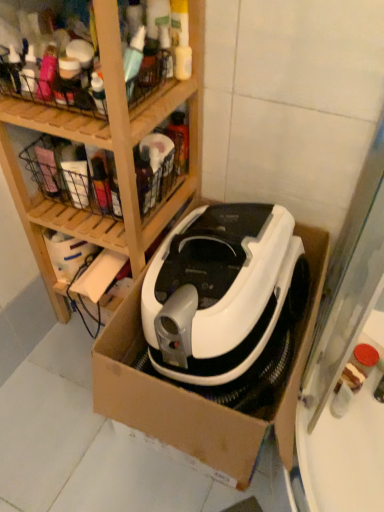
Question: Is white cardboard box at center bigger than white plastic vacuum cleaner at center?

Choices:
 (A) yes
 (B) no

Answer: (A)

Question: From a real-world perspective, is white cardboard box at center over white plastic vacuum cleaner at center?

Choices:
 (A) yes
 (B) no

Answer: (B)

Question: Considering the relative sizes of white cardboard box at center and white plastic vacuum cleaner at center in the image provided, is white cardboard box at center taller than white plastic vacuum cleaner at center?

Choices:
 (A) yes
 (B) no

Answer: (A)

Question: From a real-world perspective, is white cardboard box at center positioned under white plastic vacuum cleaner at center based on gravity?

Choices:
 (A) yes
 (B) no

Answer: (A)

Question: Is white cardboard box at center positioned behind white plastic vacuum cleaner at center?

Choices:
 (A) no
 (B) yes

Answer: (A)

Question: Would you say white cardboard box at center is a long distance from white plastic vacuum cleaner at center?

Choices:
 (A) no
 (B) yes

Answer: (A)

Question: Is metallic wire basket at upper left at the back of white plastic vacuum cleaner at center?

Choices:
 (A) no
 (B) yes

Answer: (A)

Question: Could you tell me if white plastic vacuum cleaner at center is facing metallic wire basket at upper left?

Choices:
 (A) yes
 (B) no

Answer: (B)

Question: Can you confirm if white plastic vacuum cleaner at center is taller than metallic wire basket at upper left?

Choices:
 (A) no
 (B) yes

Answer: (B)

Question: Would you say metallic wire basket at upper left is part of white plastic vacuum cleaner at center's contents?

Choices:
 (A) yes
 (B) no

Answer: (B)

Question: Can you confirm if white plastic vacuum cleaner at center is wider than metallic wire basket at upper left?

Choices:
 (A) yes
 (B) no

Answer: (A)

Question: Is white plastic vacuum cleaner at center further to camera compared to metallic wire basket at upper left?

Choices:
 (A) no
 (B) yes

Answer: (A)

Question: Is metallic wire basket at upper left smaller than white plastic vacuum cleaner at center?

Choices:
 (A) no
 (B) yes

Answer: (B)